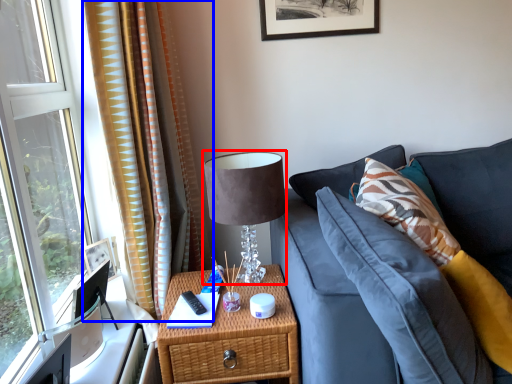
Question: Which object is closer to the camera taking this photo, table lamp (highlighted by a red box) or curtain (highlighted by a blue box)?

Choices:
 (A) table lamp
 (B) curtain

Answer: (B)